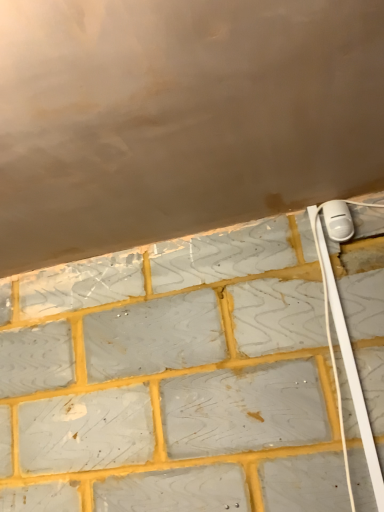
Question: Is white plastic cable at right turned away from white plastic power plug at upper right?

Choices:
 (A) no
 (B) yes

Answer: (A)

Question: Can you confirm if white plastic cable at right is positioned to the left of white plastic power plug at upper right?

Choices:
 (A) no
 (B) yes

Answer: (B)

Question: Is white plastic cable at right to the right of white plastic power plug at upper right from the viewer's perspective?

Choices:
 (A) yes
 (B) no

Answer: (B)

Question: Can we say white plastic cable at right lies outside white plastic power plug at upper right?

Choices:
 (A) no
 (B) yes

Answer: (B)

Question: Is white plastic cable at right surrounding white plastic power plug at upper right?

Choices:
 (A) yes
 (B) no

Answer: (B)

Question: Is white plastic cable at right far from white plastic power plug at upper right?

Choices:
 (A) yes
 (B) no

Answer: (B)

Question: Is the surface of white plastic power plug at upper right in direct contact with white plastic cable at right?

Choices:
 (A) yes
 (B) no

Answer: (B)

Question: Is white plastic power plug at upper right shorter than white plastic cable at right?

Choices:
 (A) no
 (B) yes

Answer: (B)

Question: Can you confirm if white plastic power plug at upper right is positioned to the left of white plastic cable at right?

Choices:
 (A) no
 (B) yes

Answer: (A)

Question: From the image's perspective, is white plastic power plug at upper right on top of white plastic cable at right?

Choices:
 (A) yes
 (B) no

Answer: (A)

Question: From the image's perspective, would you say white plastic power plug at upper right is shown under white plastic cable at right?

Choices:
 (A) yes
 (B) no

Answer: (B)

Question: Considering the relative sizes of white plastic power plug at upper right and white plastic cable at right in the image provided, is white plastic power plug at upper right smaller than white plastic cable at right?

Choices:
 (A) no
 (B) yes

Answer: (B)

Question: Is white plastic power plug at upper right spatially inside white plastic cable at right, or outside of it?

Choices:
 (A) inside
 (B) outside

Answer: (B)